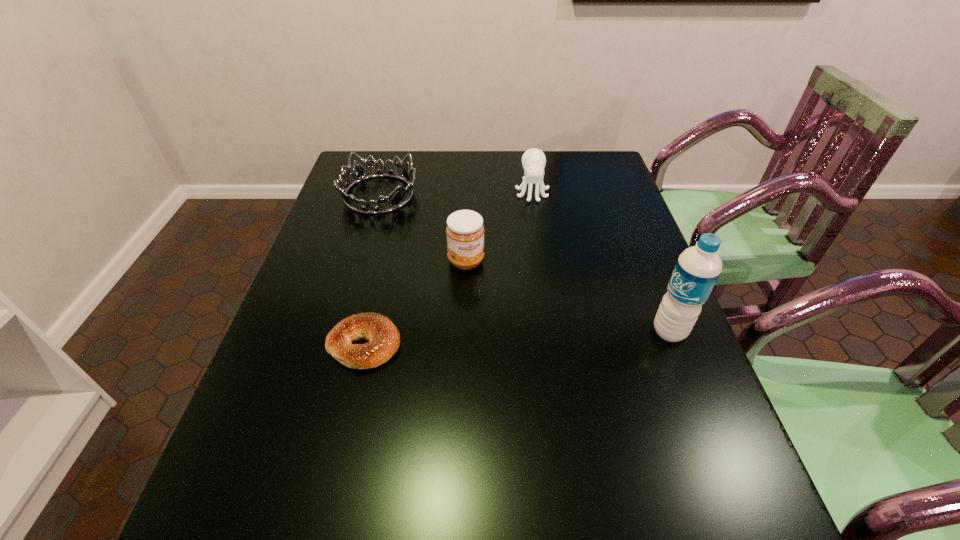
Find the location of a particular element. Image resolution: width=960 pixels, height=540 pixels. vacant space on the desktop that is between the bagel and the rightmost object and is positioned on the front-facing side of the second object from right to left is located at coordinates (552, 336).

This screenshot has width=960, height=540. Find the location of `free space on the desktop that is between the bagel and the rightmost object and is positioned on the front label of the third farthest object`. free space on the desktop that is between the bagel and the rightmost object and is positioned on the front label of the third farthest object is located at coordinates (506, 339).

Where is `vacant spot on the desktop that is between the bagel and the water bottle and is positioned on the front-facing side of the second shortest object`? Image resolution: width=960 pixels, height=540 pixels. vacant spot on the desktop that is between the bagel and the water bottle and is positioned on the front-facing side of the second shortest object is located at coordinates (564, 336).